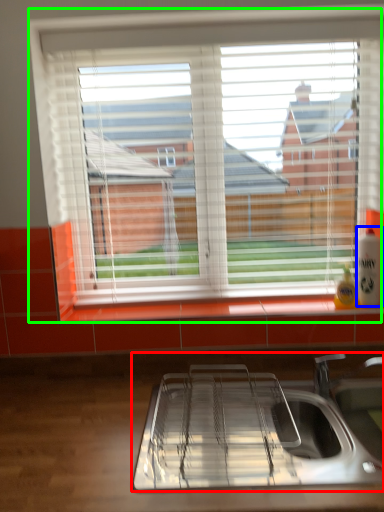
Question: Considering the real-world distances, which object is closest to sink (highlighted by a red box)? beverage (highlighted by a blue box) or window (highlighted by a green box).

Choices:
 (A) beverage
 (B) window

Answer: (A)